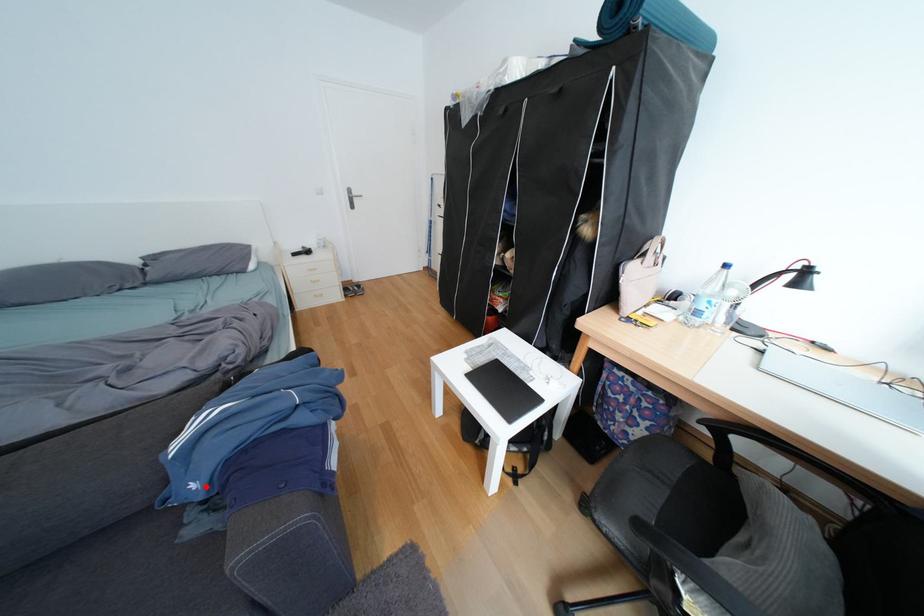
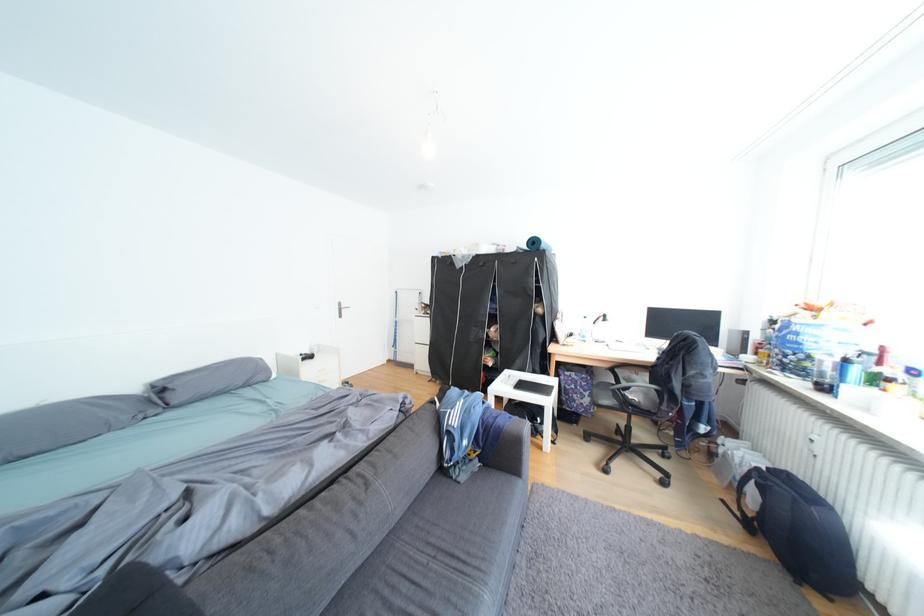
Question: I am providing you with two images of the same scene from different viewpoints. In image1, a red point is highlighted. Considering the same 3D point in image2, which of the following is correct?

Choices:
 (A) It is closer
 (B) It is farther

Answer: (B)